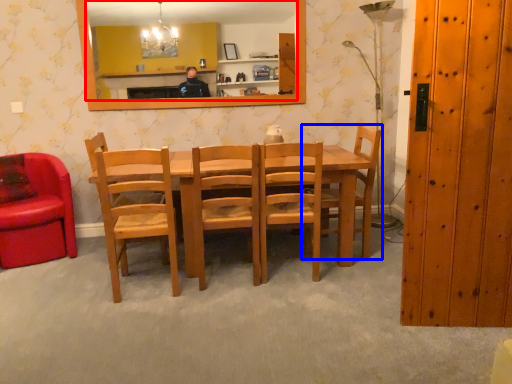
Question: Which of the following is the closest to the observer, mirror (highlighted by a red box) or chair (highlighted by a blue box)?

Choices:
 (A) mirror
 (B) chair

Answer: (B)